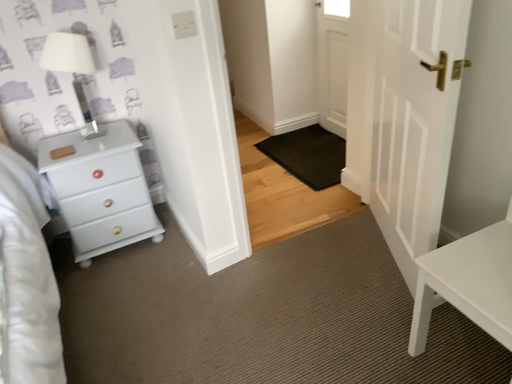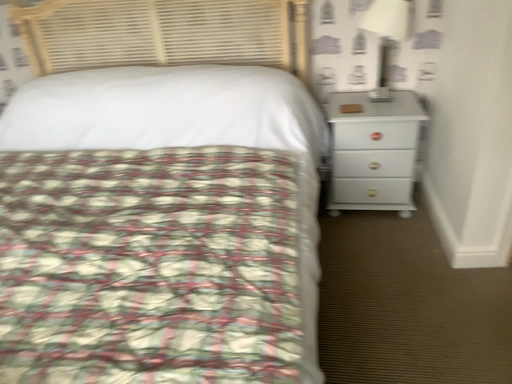
Question: How did the camera likely rotate when shooting the video?

Choices:
 (A) rotated right
 (B) rotated left

Answer: (B)